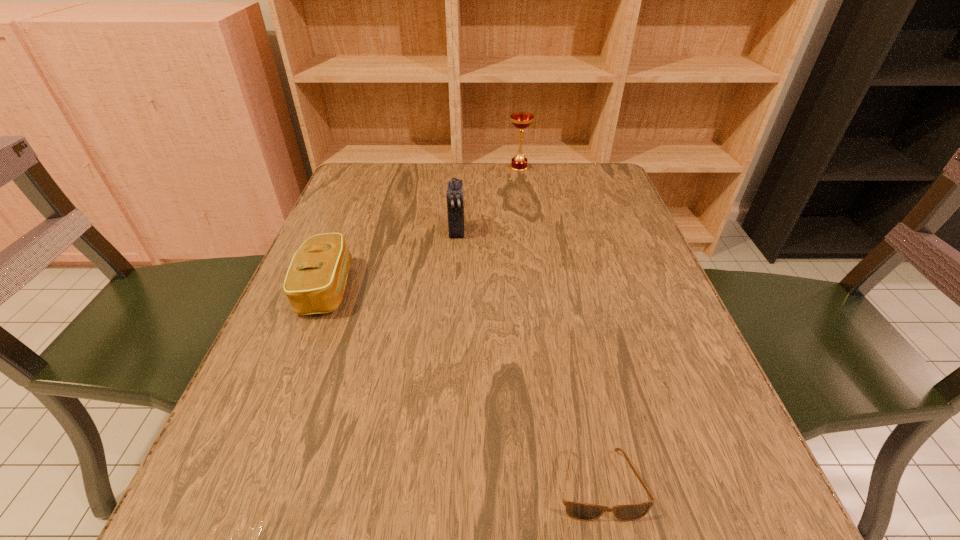
The height and width of the screenshot is (540, 960). I want to click on chalice, so click(521, 120).

Locate an element on the screen. the right clutch bag is located at coordinates (455, 196).

Identify the location of the third nearest object. The width and height of the screenshot is (960, 540). (455, 196).

Locate an element on the screen. the second shortest object is located at coordinates (315, 281).

Find the location of a particular element. Image resolution: width=960 pixels, height=540 pixels. the left clutch bag is located at coordinates tap(315, 281).

Image resolution: width=960 pixels, height=540 pixels. Find the location of `sunglasses`. sunglasses is located at coordinates (580, 511).

Identify the location of the shortest object. This screenshot has height=540, width=960. 580,511.

This screenshot has width=960, height=540. I want to click on free location located on the left of the chalice, so click(383, 168).

The image size is (960, 540). Identify the location of vacant space located 0.270m with the zip open on the right clutch bag. (450, 330).

Locate an element on the screen. vacant space located 0.310m on the zipper side of the second shortest object is located at coordinates (506, 288).